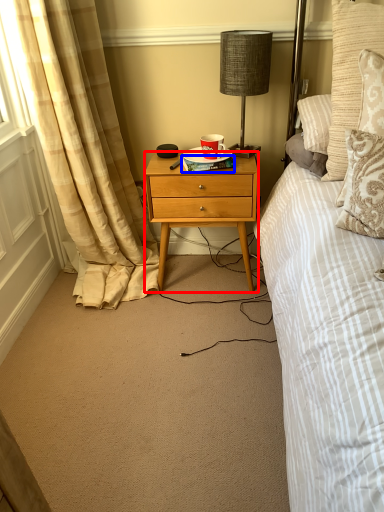
Question: Which point is closer to the camera, desk (highlighted by a red box) or book (highlighted by a blue box)?

Choices:
 (A) desk
 (B) book

Answer: (A)